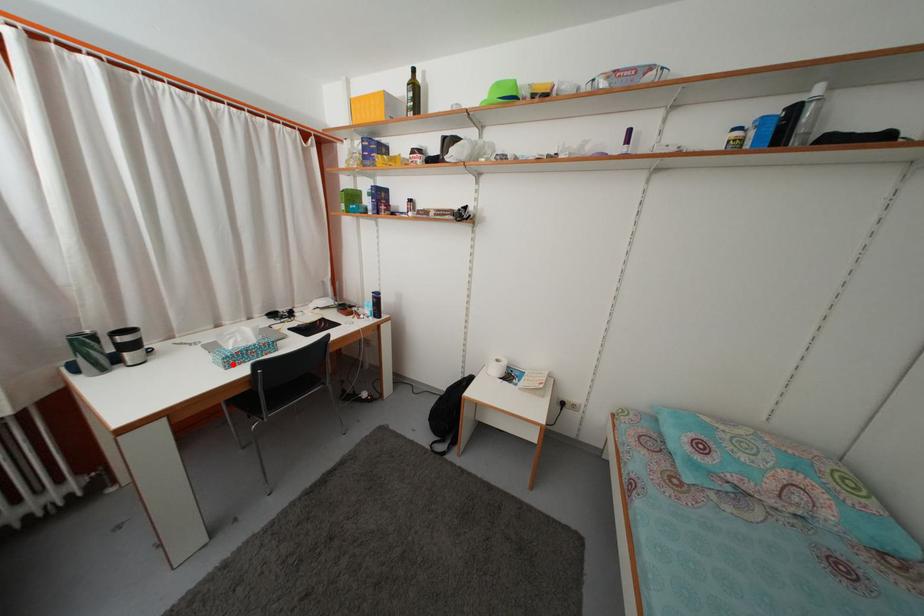
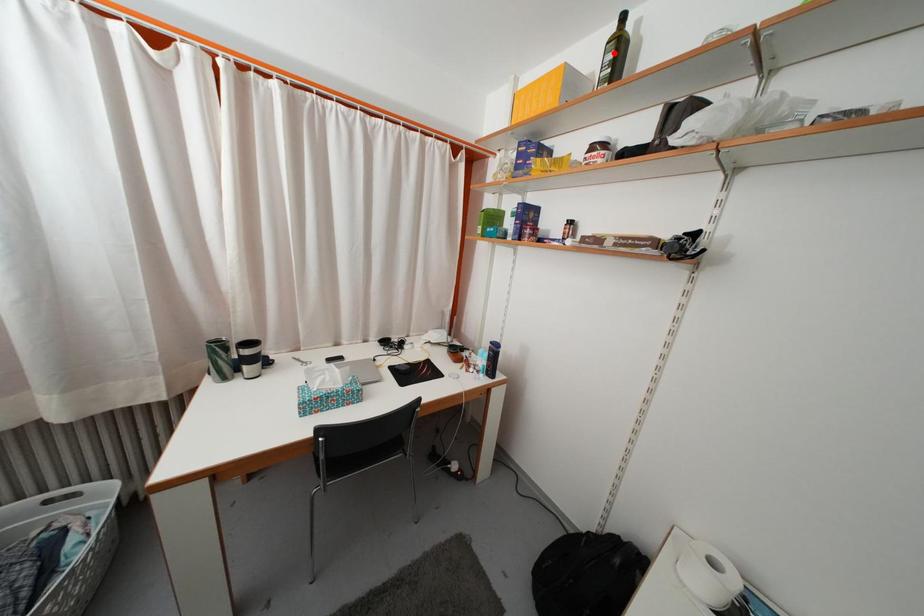
I am providing you with two images of the same scene from different viewpoints. A red point is marked on the first image and another point is marked on the second image. Do the highlighted points in image1 and image2 indicate the same real-world spot?

No